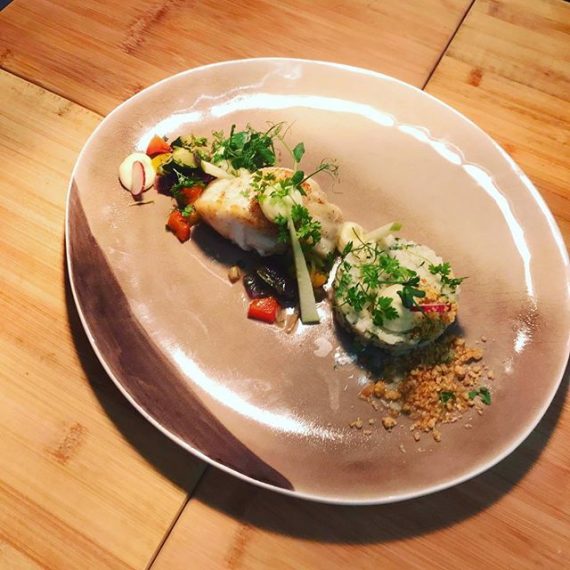
Locate an element on the screen. This screenshot has height=570, width=570. wooden table is located at coordinates 82,443.